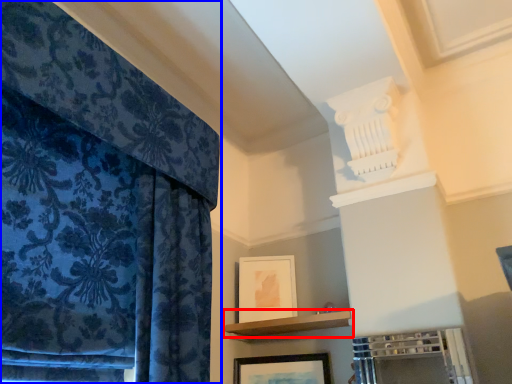
Question: Which object appears closest to the camera in this image, shelf (highlighted by a red box) or curtain (highlighted by a blue box)?

Choices:
 (A) shelf
 (B) curtain

Answer: (B)